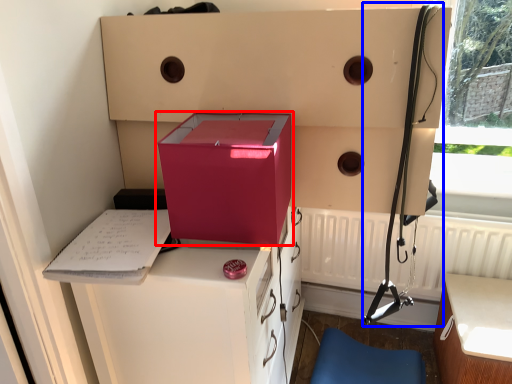
Question: Among these objects, which one is farthest to the camera, box (highlighted by a red box) or twin (highlighted by a blue box)?

Choices:
 (A) box
 (B) twin

Answer: (B)